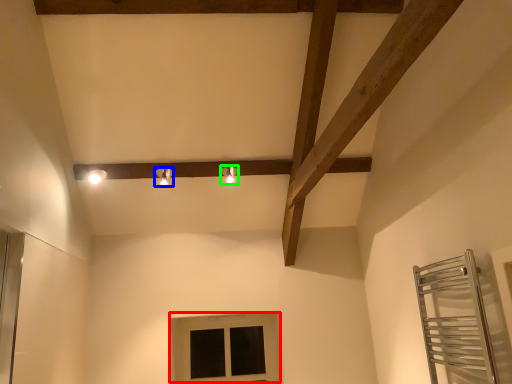
Question: Which is farther away from window (highlighted by a red box)? light fixture (highlighted by a blue box) or light fixture (highlighted by a green box)?

Choices:
 (A) light fixture
 (B) light fixture

Answer: (A)